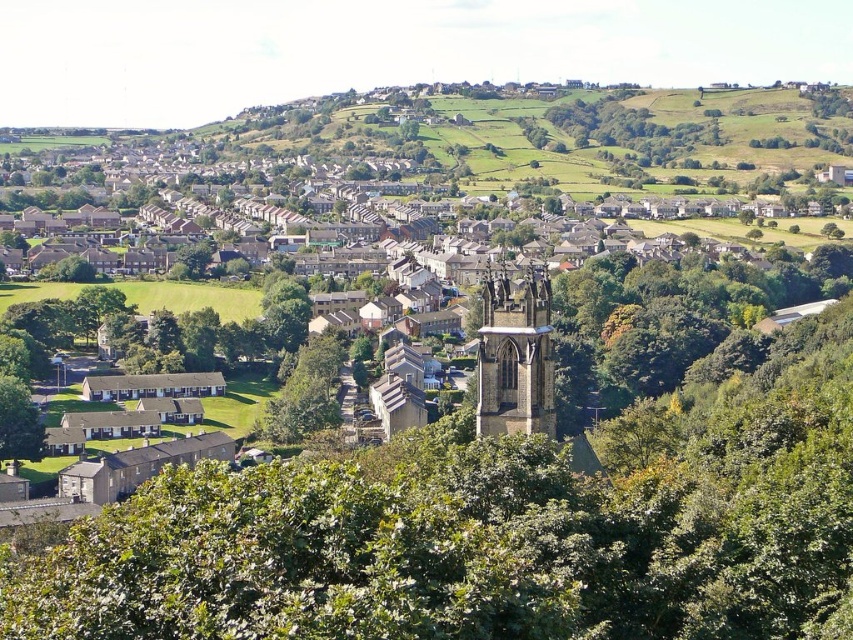
Question: Which point is farther to the camera?

Choices:
 (A) dark gray stone tower at center
 (B) green leafy trees at upper right
 (C) green leafy tree at center

Answer: (B)

Question: Which object appears farthest from the camera in this image?

Choices:
 (A) green leafy tree at center
 (B) dark gray stone tower at center
 (C) green leafy trees at upper right

Answer: (C)

Question: Does green leafy tree at center come in front of green leafy trees at upper right?

Choices:
 (A) no
 (B) yes

Answer: (B)

Question: In this image, where is dark gray stone tower at center located relative to green leafy trees at upper right?

Choices:
 (A) below
 (B) above

Answer: (A)

Question: Estimate the real-world distances between objects in this image. Which object is closer to the dark gray stone tower at center?

Choices:
 (A) green leafy trees at upper right
 (B) green leafy tree at center

Answer: (B)

Question: Can you confirm if green leafy tree at center is positioned above dark gray stone tower at center?

Choices:
 (A) no
 (B) yes

Answer: (A)